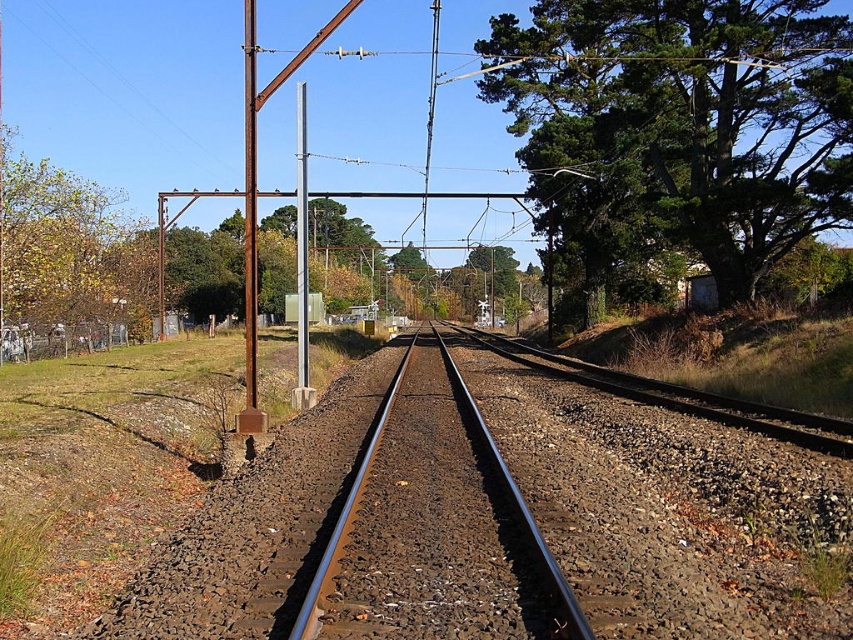
You are a railway worker inspecting the tracks. You notice the green leafy tree at upper right and the metallic pole at center. Which object has a smaller width when viewed from your current position?

The green leafy tree at upper right is thinner than the metallic pole at center, so the green leafy tree at upper right has a smaller width.

You are a photographer standing at the center of the railway tracks. You want to take a photo that includes both the green leafy tree at upper right and the rusty metal pole at left. Which object should you adjust your camera focus on first to ensure both are in the frame?

The green leafy tree at upper right is closer to the viewer than the rusty metal pole at left, so you should focus on the green leafy tree at upper right first to ensure both are in the frame.

You are a maintenance worker needing to inspect the rusty metal pole at left and the green leafy tree at upper right. Given that your inspection equipment has a maximum effective range of 25 meters, can you inspect both objects from your current position between them without moving?

The distance between the green leafy tree at upper right and the rusty metal pole at left is 24.19 meters. Since your equipment has a maximum range of 25 meters, you can inspect both objects from your current position as the distance is within the effective range.